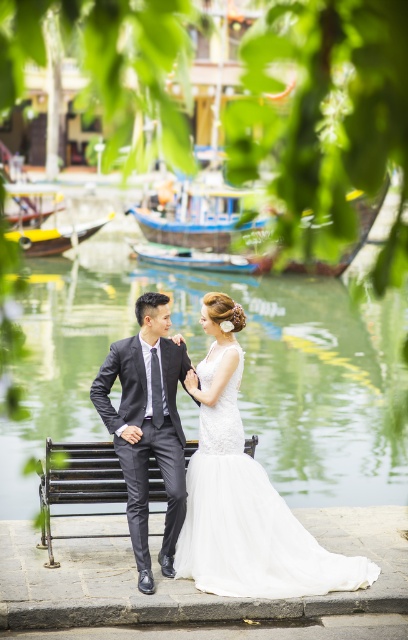
Question: Does dark gray suit at center have a smaller size compared to wooden boat at lower left?

Choices:
 (A) yes
 (B) no

Answer: (A)

Question: Which point is farther from the camera taking this photo?

Choices:
 (A) (359, 435)
 (B) (139, 465)
 (C) (330, 554)

Answer: (A)

Question: Considering the relative positions of clear water at bench center and black metal bench at center in the image provided, where is clear water at bench center located with respect to black metal bench at center?

Choices:
 (A) left
 (B) right

Answer: (B)

Question: From the image, what is the correct spatial relationship of clear water at bench center in relation to white lace dress at center?

Choices:
 (A) left
 (B) right

Answer: (B)

Question: Which object is the farthest from the dark gray suit at center?

Choices:
 (A) wooden boat at lower left
 (B) white lace dress at center

Answer: (A)

Question: Which point is farther from the camera taking this photo?

Choices:
 (A) (121, 362)
 (B) (81, 227)
 (C) (370, 476)

Answer: (B)